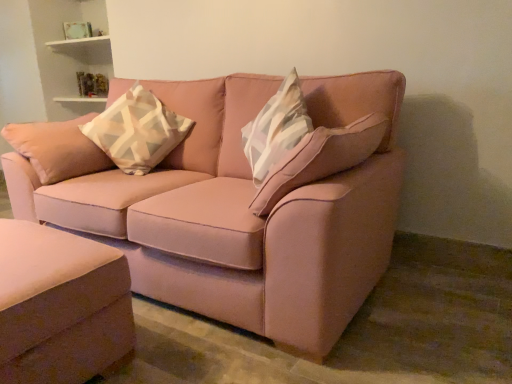
Question: From the image's perspective, does white and gray geometric-patterned pillow at upper left appear lower than matte pink fabric couch at center, which is counted as the 2th studio couch, starting from the bottom?

Choices:
 (A) yes
 (B) no

Answer: (B)

Question: Does white and gray geometric-patterned pillow at upper left turn towards matte pink fabric couch at center, which is counted as the 1th studio couch, starting from the top?

Choices:
 (A) no
 (B) yes

Answer: (B)

Question: Does white and gray geometric-patterned pillow at upper left appear on the right side of matte pink fabric couch at center, which is counted as the 1th studio couch, starting from the top?

Choices:
 (A) no
 (B) yes

Answer: (A)

Question: Does white and gray geometric-patterned pillow at upper left appear on the left side of matte pink fabric couch at center, which is counted as the 2th studio couch, starting from the bottom?

Choices:
 (A) no
 (B) yes

Answer: (B)

Question: Can you confirm if white and gray geometric-patterned pillow at upper left is taller than matte pink fabric couch at center, which is counted as the 1th studio couch, starting from the top?

Choices:
 (A) no
 (B) yes

Answer: (A)

Question: Considering the relative positions of white and gray geometric-patterned pillow at upper left and satin pink ottoman at lower left, which ranks as the 1th studio couch in bottom-to-top order, in the image provided, is white and gray geometric-patterned pillow at upper left to the left or to the right of satin pink ottoman at lower left, which ranks as the 1th studio couch in bottom-to-top order,?

Choices:
 (A) left
 (B) right

Answer: (B)

Question: Is white and gray geometric-patterned pillow at upper left bigger or smaller than satin pink ottoman at lower left, positioned as the 2th studio couch in top-to-bottom order?

Choices:
 (A) small
 (B) big

Answer: (A)

Question: Considering the positions of white and gray geometric-patterned pillow at upper left and satin pink ottoman at lower left, positioned as the 2th studio couch in top-to-bottom order, in the image, is white and gray geometric-patterned pillow at upper left wider or thinner than satin pink ottoman at lower left, positioned as the 2th studio couch in top-to-bottom order,?

Choices:
 (A) wide
 (B) thin

Answer: (A)

Question: Is white and gray geometric-patterned pillow at upper left situated inside satin pink ottoman at lower left, which ranks as the 1th studio couch in bottom-to-top order, or outside?

Choices:
 (A) inside
 (B) outside

Answer: (B)

Question: Considering the positions of point (133, 268) and point (180, 137), is point (133, 268) closer or farther from the camera than point (180, 137)?

Choices:
 (A) farther
 (B) closer

Answer: (B)

Question: From the image's perspective, is matte pink fabric couch at center, which is counted as the 2th studio couch, starting from the bottom, above or below white and gray geometric-patterned pillow at upper left?

Choices:
 (A) below
 (B) above

Answer: (A)

Question: In the image, is matte pink fabric couch at center, which is counted as the 2th studio couch, starting from the bottom, positioned in front of or behind white and gray geometric-patterned pillow at upper left?

Choices:
 (A) front
 (B) behind

Answer: (A)

Question: Looking at their shapes, would you say matte pink fabric couch at center, which is counted as the 2th studio couch, starting from the bottom, is wider or thinner than white and gray geometric-patterned pillow at upper left?

Choices:
 (A) thin
 (B) wide

Answer: (B)

Question: Which is correct: matte pink fabric couch at center, which is counted as the 2th studio couch, starting from the bottom, is inside satin pink ottoman at lower left, positioned as the 2th studio couch in top-to-bottom order, or outside of it?

Choices:
 (A) outside
 (B) inside

Answer: (A)

Question: Looking at the image, does matte pink fabric couch at center, which is counted as the 2th studio couch, starting from the bottom, seem bigger or smaller compared to satin pink ottoman at lower left, positioned as the 2th studio couch in top-to-bottom order?

Choices:
 (A) big
 (B) small

Answer: (A)